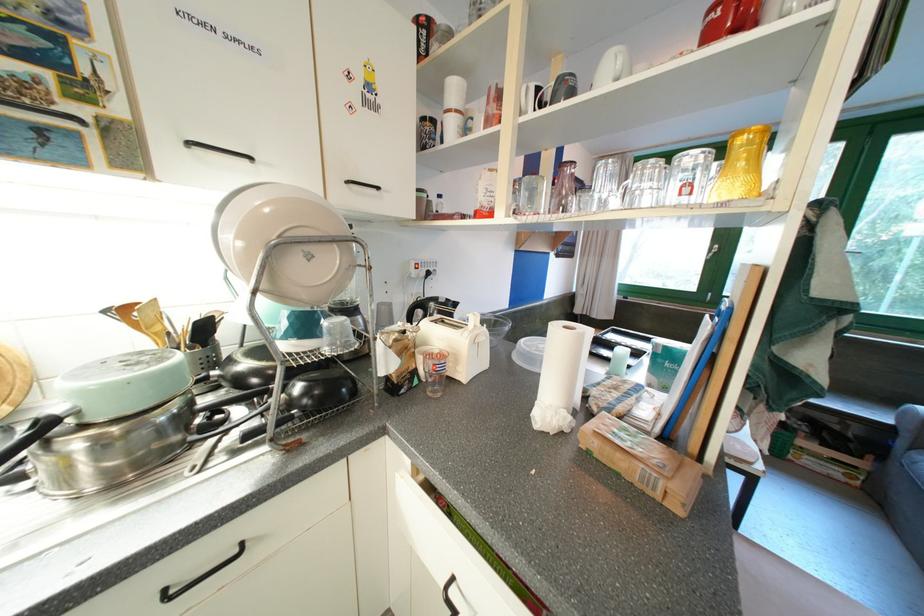
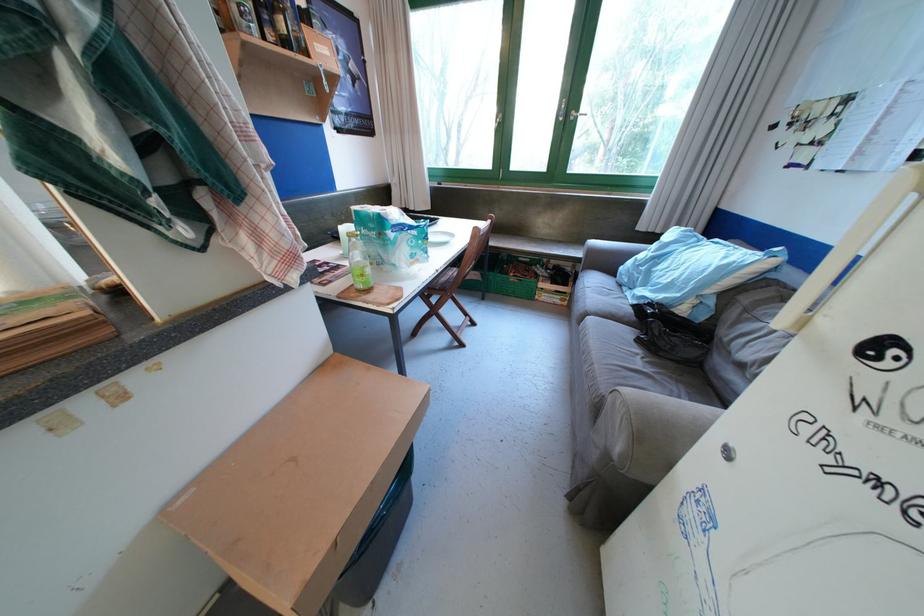
First-person continuous shooting, in which direction is the camera rotating?

The rotation direction of the camera is right-down.